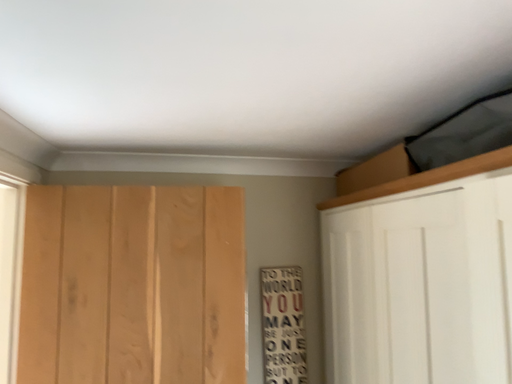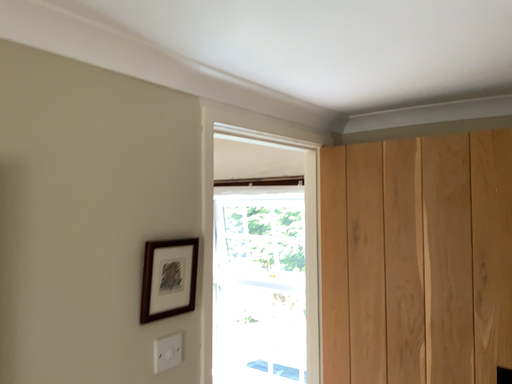
Question: Which way did the camera rotate in the video?

Choices:
 (A) rotated right
 (B) rotated left

Answer: (B)